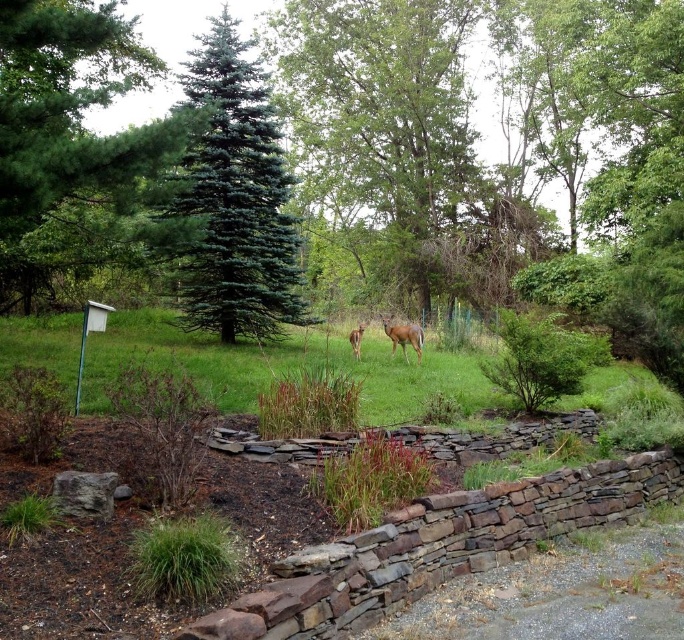
You are standing in the garden and want to take a photo of the brown furry deer at center. The green grass at center is blocking your view. Can you move closer to the deer without stepping on the grass?

The green grass at center is closer to the viewer than the brown furry deer at center, so you can move closer to the deer without stepping on the grass by moving forward past the grass to get a clearer view.

You are a gardener who wants to plant a row of flowers between the green grass at center and the brown furry deer at center. Which side should you choose to ensure the flowers have enough space to grow?

The green grass at center is wider than the brown furry deer at center, so you should plant the flowers on the side of the green grass at center to ensure they have enough space to grow.